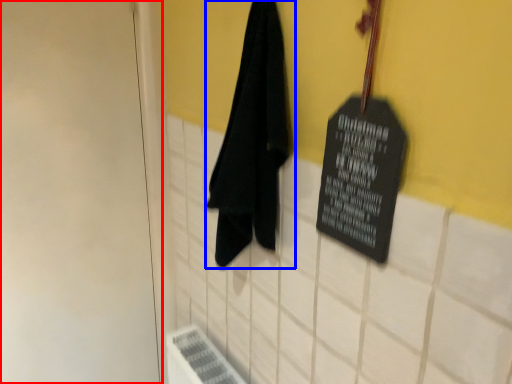
Question: Which object is further to the camera taking this photo, door (highlighted by a red box) or towel (highlighted by a blue box)?

Choices:
 (A) door
 (B) towel

Answer: (A)